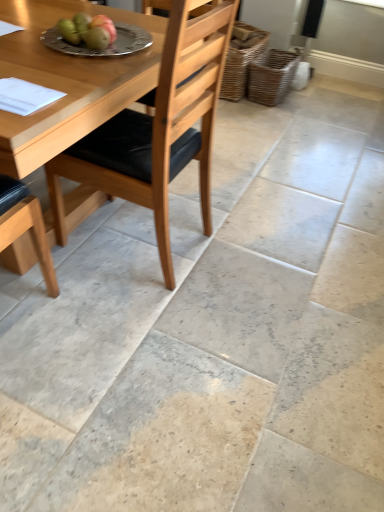
Question: Can you confirm if silver metallic plate at upper center is thinner than green matte apple at upper left, which ranks as the first fruit in left-to-right order?

Choices:
 (A) no
 (B) yes

Answer: (A)

Question: From a real-world perspective, is silver metallic plate at upper center located beneath green matte apple at upper left, which ranks as the first fruit in left-to-right order?

Choices:
 (A) yes
 (B) no

Answer: (A)

Question: From the image's perspective, would you say silver metallic plate at upper center is positioned over green matte apple at upper left, which ranks as the first fruit in left-to-right order?

Choices:
 (A) no
 (B) yes

Answer: (B)

Question: Does silver metallic plate at upper center have a greater width compared to green matte apple at upper left, the 2th fruit from the right?

Choices:
 (A) no
 (B) yes

Answer: (B)

Question: Are silver metallic plate at upper center and green matte apple at upper left, which ranks as the first fruit in left-to-right order, located far from each other?

Choices:
 (A) yes
 (B) no

Answer: (B)

Question: Considering the positions of point (261, 51) and point (94, 47), is point (261, 51) closer or farther from the camera than point (94, 47)?

Choices:
 (A) closer
 (B) farther

Answer: (B)

Question: Do you think woven brown basket at center, the 1th basket viewed from the left, is within green matte pear at upper left, which is the first fruit in right-to-left order, or outside of it?

Choices:
 (A) outside
 (B) inside

Answer: (A)

Question: Is woven brown basket at center, which is the 2th basket from right to left, taller or shorter than green matte pear at upper left, which is the first fruit in right-to-left order?

Choices:
 (A) tall
 (B) short

Answer: (A)

Question: In the image, is woven brown basket at center, which is the 2th basket from right to left, on the left side or the right side of green matte pear at upper left, which appears as the 2th fruit when viewed from the left?

Choices:
 (A) right
 (B) left

Answer: (A)

Question: Looking at their shapes, would you say green matte apple at upper left, the 2th fruit from the right, is wider or thinner than woven brown basket at center, the 1th basket viewed from the left?

Choices:
 (A) wide
 (B) thin

Answer: (B)

Question: Is point (61, 27) closer or farther from the camera than point (231, 47)?

Choices:
 (A) closer
 (B) farther

Answer: (A)

Question: Based on their sizes in the image, would you say green matte apple at upper left, which ranks as the first fruit in left-to-right order, is bigger or smaller than woven brown basket at center, which is the 2th basket from right to left?

Choices:
 (A) big
 (B) small

Answer: (B)

Question: Is green matte apple at upper left, the 2th fruit from the right, inside the boundaries of woven brown basket at center, the 1th basket viewed from the left, or outside?

Choices:
 (A) outside
 (B) inside

Answer: (A)

Question: From the image's perspective, is green matte pear at upper left, which appears as the 2th fruit when viewed from the left, positioned above or below silver metallic plate at upper center?

Choices:
 (A) below
 (B) above

Answer: (A)

Question: Is green matte pear at upper left, which is the first fruit in right-to-left order, to the left or to the right of silver metallic plate at upper center in the image?

Choices:
 (A) left
 (B) right

Answer: (B)